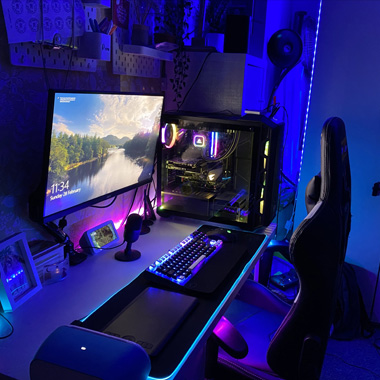
At what (x,y) coordinates should I click in order to perform the action: click on amazon echo device. Please return your answer as a coordinate pair (x, y). Looking at the image, I should click on (102, 228).